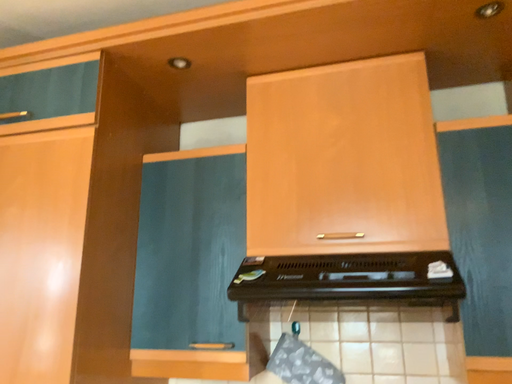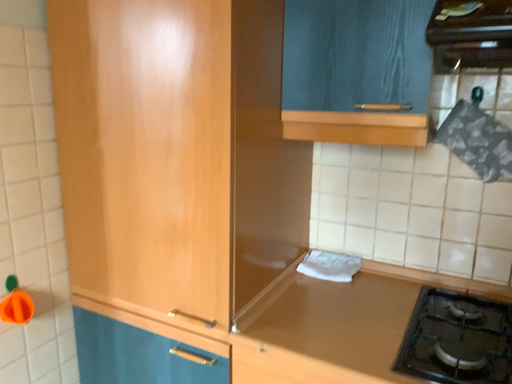
Question: How did the camera likely rotate when shooting the video?

Choices:
 (A) rotated downward
 (B) rotated upward

Answer: (A)